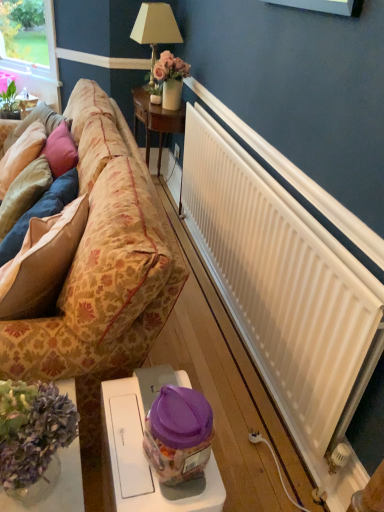
Question: Is floral-patterned fabric couch at left inside suede-like beige pillow at left, the 3th pillow positioned from the left?

Choices:
 (A) no
 (B) yes

Answer: (A)

Question: Is the depth of suede-like beige pillow at left, the 3th pillow positioned from the left, less than that of floral-patterned fabric couch at left?

Choices:
 (A) yes
 (B) no

Answer: (B)

Question: Is suede-like beige pillow at left, the 3th pillow positioned from the left, behind floral-patterned fabric couch at left?

Choices:
 (A) no
 (B) yes

Answer: (B)

Question: Is suede-like beige pillow at left, the 3th pillow positioned from the left, not within floral-patterned fabric couch at left?

Choices:
 (A) no
 (B) yes

Answer: (A)

Question: Considering the relative sizes of suede-like beige pillow at left, placed as the 1th pillow when sorted from right to left, and floral-patterned fabric couch at left in the image provided, is suede-like beige pillow at left, placed as the 1th pillow when sorted from right to left, thinner than floral-patterned fabric couch at left?

Choices:
 (A) yes
 (B) no

Answer: (A)

Question: In the image, is suede-like beige pillow at left, the 3th pillow positioned from the left, positioned in front of or behind velvet beige pillow at left, which appears as the 3th pillow when viewed from the right?

Choices:
 (A) behind
 (B) front

Answer: (B)

Question: Is suede-like beige pillow at left, the 3th pillow positioned from the left, inside or outside of velvet beige pillow at left, which appears as the 3th pillow when viewed from the right?

Choices:
 (A) outside
 (B) inside

Answer: (A)

Question: Does point (29, 266) appear closer or farther from the camera than point (0, 163)?

Choices:
 (A) closer
 (B) farther

Answer: (A)

Question: From the image's perspective, relative to velvet beige pillow at left, which appears as the 3th pillow when viewed from the right, is suede-like beige pillow at left, placed as the 1th pillow when sorted from right to left, above or below?

Choices:
 (A) above
 (B) below

Answer: (B)

Question: From a real-world perspective, is velvet beige pillow at left, which appears as the 3th pillow when viewed from the right, above or below white plastic table at lower center, acting as the second table starting from the top?

Choices:
 (A) below
 (B) above

Answer: (B)

Question: Considering the positions of point 21,150 and point 140,418, is point 21,150 closer or farther from the camera than point 140,418?

Choices:
 (A) closer
 (B) farther

Answer: (B)

Question: Is velvet beige pillow at left, which appears as the 3th pillow when viewed from the right, taller or shorter than white plastic table at lower center, arranged as the third table when viewed from the back?

Choices:
 (A) short
 (B) tall

Answer: (A)

Question: Considering the relative positions of velvet beige pillow at left, placed as the 1th pillow when sorted from left to right, and white plastic table at lower center, arranged as the third table when viewed from the back, in the image provided, is velvet beige pillow at left, placed as the 1th pillow when sorted from left to right, to the left or to the right of white plastic table at lower center, arranged as the third table when viewed from the back,?

Choices:
 (A) left
 (B) right

Answer: (A)

Question: Considering the positions of suede-like beige pillow at left, the 3th pillow positioned from the left, and floral-patterned fabric couch at left in the image, is suede-like beige pillow at left, the 3th pillow positioned from the left, taller or shorter than floral-patterned fabric couch at left?

Choices:
 (A) short
 (B) tall

Answer: (A)

Question: Is suede-like beige pillow at left, placed as the 1th pillow when sorted from right to left, bigger or smaller than floral-patterned fabric couch at left?

Choices:
 (A) small
 (B) big

Answer: (A)